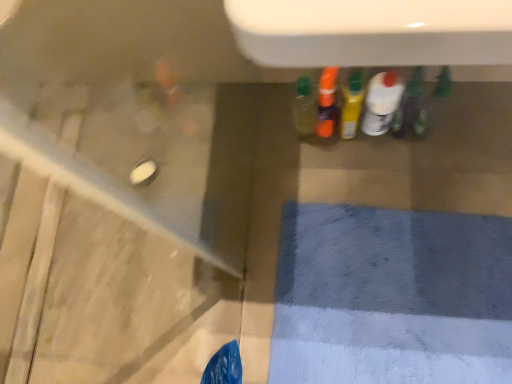
Identify the location of vacant area to the left of translucent plastic bottle at center, the fifth bottle positioned from the right. This screenshot has width=512, height=384. pyautogui.click(x=260, y=155).